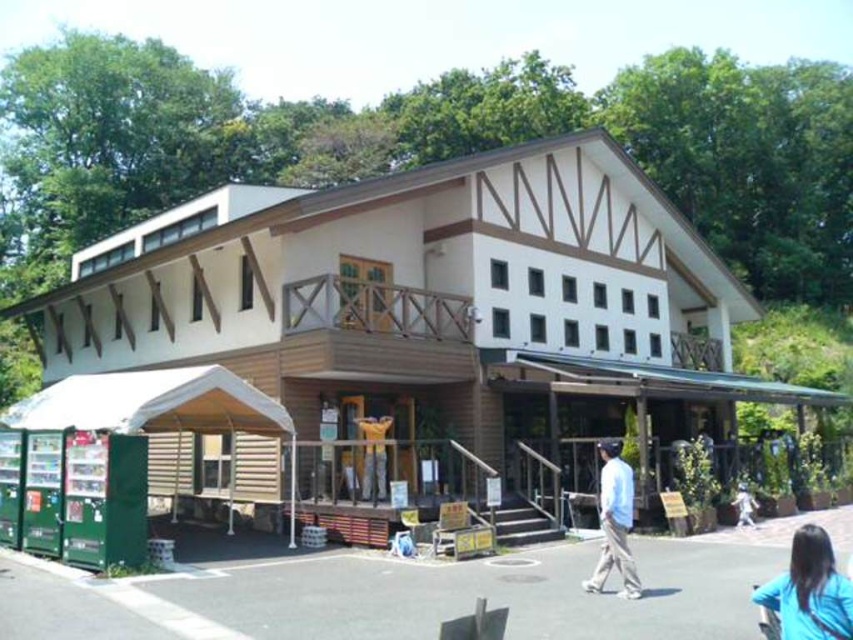
You are standing at the wooden statue at center and want to reach the white cotton shirt at lower right. What is the shortest distance you need to travel?

The shortest distance between the wooden statue at center and the white cotton shirt at lower right is 7.21 meters.

You are a maintenance worker needing to reach both the light blue shirt at center and the wooden statue at center with a 5m long ladder. Can you use the same ladder for both without moving it?

The distance between the light blue shirt at center and the wooden statue at center is 17.18 feet, which is approximately 5.23 meters. Since the ladder is only 5 meters long, it cannot span the entire distance. Therefore, you would need to move the ladder to access both locations.

You are standing in front of the building and notice two shirts. The blue fabric shirt at lower right and the light blue shirt at center. Which shirt is positioned more to the right side?

The blue fabric shirt at lower right is positioned to the right of the light blue shirt at center, so it is more to the right side.